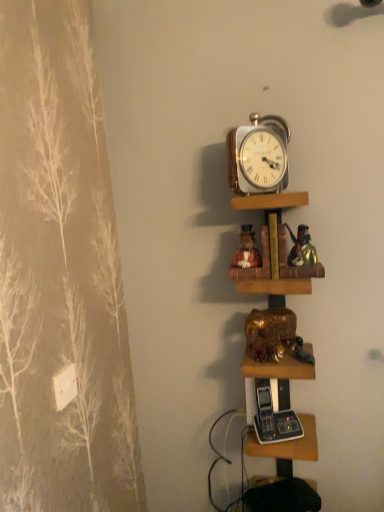
The width and height of the screenshot is (384, 512). What do you see at coordinates (274, 249) in the screenshot? I see `matte ceramic figurines at center, arranged as the first shelf when viewed from the top` at bounding box center [274, 249].

The width and height of the screenshot is (384, 512). Identify the location of gold metallic elephant at center. (270, 332).

Does gold metallic elephant at center contain matte ceramic figurines at center, arranged as the first shelf when viewed from the top?

No, gold metallic elephant at center does not contain matte ceramic figurines at center, arranged as the first shelf when viewed from the top.

From the image's perspective, is gold metallic elephant at center under matte ceramic figurines at center, the 2th shelf from the bottom?

Yes.

Identify the location of toy that appears below the matte ceramic figurines at center, arranged as the first shelf when viewed from the top (from the image's perspective). The height and width of the screenshot is (512, 384). (270, 332).

Is gold metallic elephant at center turned away from matte ceramic figurines at center, arranged as the first shelf when viewed from the top?

That's not correct — gold metallic elephant at center is not looking away from matte ceramic figurines at center, arranged as the first shelf when viewed from the top.

Considering the sizes of objects gold metallic alarm clock at upper center and matte ceramic figurines at center, arranged as the first shelf when viewed from the top, in the image provided, who is wider, gold metallic alarm clock at upper center or matte ceramic figurines at center, arranged as the first shelf when viewed from the top,?

matte ceramic figurines at center, arranged as the first shelf when viewed from the top, is wider.

Is matte ceramic figurines at center, the 2th shelf from the bottom, located within gold metallic alarm clock at upper center?

No, matte ceramic figurines at center, the 2th shelf from the bottom, is located outside of gold metallic alarm clock at upper center.

Looking at the image, does gold metallic alarm clock at upper center seem bigger or smaller compared to matte ceramic figurines at center, arranged as the first shelf when viewed from the top?

Clearly, gold metallic alarm clock at upper center is smaller in size than matte ceramic figurines at center, arranged as the first shelf when viewed from the top.

Can you confirm if gold metallic alarm clock at upper center is taller than matte ceramic figurines at center, the 2th shelf from the bottom?

Yes.

Is matte ceramic figurines at center, arranged as the first shelf when viewed from the top, bigger than wooden shelves at center, positioned as the second shelf in top-to-bottom order?

No, matte ceramic figurines at center, arranged as the first shelf when viewed from the top, is not bigger than wooden shelves at center, positioned as the second shelf in top-to-bottom order.

Is matte ceramic figurines at center, arranged as the first shelf when viewed from the top, placed right next to wooden shelves at center, positioned as the 1th shelf in bottom-to-top order?

Yes, the surface of matte ceramic figurines at center, arranged as the first shelf when viewed from the top, is in contact with wooden shelves at center, positioned as the 1th shelf in bottom-to-top order.

Does point (266, 204) come in front of point (313, 422)?

Yes, it is in front of point (313, 422).

From a real-world perspective, is matte ceramic figurines at center, the 2th shelf from the bottom, physically below wooden shelves at center, positioned as the second shelf in top-to-bottom order?

No, from a real-world perspective, matte ceramic figurines at center, the 2th shelf from the bottom, is not below wooden shelves at center, positioned as the second shelf in top-to-bottom order.

Is point (259, 285) closer or farther from the camera than point (276, 121)?

Clearly, point (259, 285) is closer to the camera than point (276, 121).

Which of these two, matte ceramic figurines at center, arranged as the first shelf when viewed from the top, or gold metallic alarm clock at upper center, is thinner?

gold metallic alarm clock at upper center.

Does matte ceramic figurines at center, the 2th shelf from the bottom, appear on the right side of gold metallic alarm clock at upper center?

Yes, matte ceramic figurines at center, the 2th shelf from the bottom, is to the right of gold metallic alarm clock at upper center.

From the picture: Is matte ceramic figurines at center, the 2th shelf from the bottom, facing away from gold metallic alarm clock at upper center?

matte ceramic figurines at center, the 2th shelf from the bottom, does not have its back to gold metallic alarm clock at upper center.

Is matte ceramic figurines at center, arranged as the first shelf when viewed from the top, in front of gold metallic elephant at center?

Yes, matte ceramic figurines at center, arranged as the first shelf when viewed from the top, is in front of gold metallic elephant at center.

Consider the image. Is matte ceramic figurines at center, the 2th shelf from the bottom, oriented towards gold metallic elephant at center?

No, matte ceramic figurines at center, the 2th shelf from the bottom, is not oriented towards gold metallic elephant at center.

You are a GUI agent. You are given a task and a screenshot of the screen. Output one action in this format:
    pyautogui.click(x=<x>, y=<y>)
    Task: Click on the shelf located on the left of gold metallic elephant at center
    The height and width of the screenshot is (512, 384).
    Given the screenshot: What is the action you would take?
    pyautogui.click(x=274, y=249)

Is matte ceramic figurines at center, arranged as the first shelf when viewed from the top, next to gold metallic elephant at center and touching it?

No, matte ceramic figurines at center, arranged as the first shelf when viewed from the top, is not next to gold metallic elephant at center.

From a real-world perspective, which object stands above the other?

From a 3D spatial view, gold metallic alarm clock at upper center is above.

Is gold metallic elephant at center facing towards gold metallic alarm clock at upper center?

No, gold metallic elephant at center is not oriented towards gold metallic alarm clock at upper center.

From the picture: How different are the orientations of gold metallic elephant at center and gold metallic alarm clock at upper center in degrees?

The facing directions of gold metallic elephant at center and gold metallic alarm clock at upper center are 40.7 degrees apart.

Which object is closer to the camera, gold metallic elephant at center or gold metallic alarm clock at upper center?

gold metallic alarm clock at upper center is more forward.

Based on the photo, would you consider gold metallic alarm clock at upper center to be distant from gold metallic elephant at center?

gold metallic alarm clock at upper center is near gold metallic elephant at center, not far away.

From a real-world perspective, is gold metallic alarm clock at upper center positioned under gold metallic elephant at center based on gravity?

No.

Considering the sizes of objects gold metallic alarm clock at upper center and gold metallic elephant at center in the image provided, who is shorter, gold metallic alarm clock at upper center or gold metallic elephant at center?

gold metallic elephant at center.

Identify the location of toy behind the matte ceramic figurines at center, arranged as the first shelf when viewed from the top. The height and width of the screenshot is (512, 384). (270, 332).

Find the location of a particular element. alarm clock on the left of the matte ceramic figurines at center, the 2th shelf from the bottom is located at coordinates (258, 155).

Considering their positions, is gold metallic elephant at center positioned further to wooden shelves at center, positioned as the 1th shelf in bottom-to-top order, than matte ceramic figurines at center, arranged as the first shelf when viewed from the top?

Based on the image, gold metallic elephant at center appears to be further to wooden shelves at center, positioned as the 1th shelf in bottom-to-top order.

Considering their positions, is wooden shelves at center, positioned as the second shelf in top-to-bottom order, positioned closer to gold metallic elephant at center than matte ceramic figurines at center, arranged as the first shelf when viewed from the top?

wooden shelves at center, positioned as the second shelf in top-to-bottom order, lies closer to gold metallic elephant at center than the other object.

From the image, which object appears to be farther from wooden shelves at center, positioned as the 1th shelf in bottom-to-top order, gold metallic alarm clock at upper center or gold metallic elephant at center?

Among the two, gold metallic alarm clock at upper center is located further to wooden shelves at center, positioned as the 1th shelf in bottom-to-top order.

Estimate the real-world distances between objects in this image. Which object is closer to wooden shelves at center, positioned as the second shelf in top-to-bottom order, gold metallic elephant at center or gold metallic alarm clock at upper center?

Based on the image, gold metallic elephant at center appears to be nearer to wooden shelves at center, positioned as the second shelf in top-to-bottom order.

When comparing their distances from gold metallic alarm clock at upper center, does gold metallic elephant at center or matte ceramic figurines at center, the 2th shelf from the bottom, seem further?

Based on the image, gold metallic elephant at center appears to be further to gold metallic alarm clock at upper center.

Based on their spatial positions, is gold metallic elephant at center or wooden shelves at center, positioned as the 1th shelf in bottom-to-top order, closer to gold metallic alarm clock at upper center?

wooden shelves at center, positioned as the 1th shelf in bottom-to-top order, is positioned closer to the anchor gold metallic alarm clock at upper center.

From the image, which object appears to be nearer to matte ceramic figurines at center, arranged as the first shelf when viewed from the top, wooden shelves at center, positioned as the 1th shelf in bottom-to-top order, or gold metallic alarm clock at upper center?

wooden shelves at center, positioned as the 1th shelf in bottom-to-top order, is positioned closer to the anchor matte ceramic figurines at center, arranged as the first shelf when viewed from the top.

Looking at the image, which one is located further to matte ceramic figurines at center, the 2th shelf from the bottom, wooden shelves at center, positioned as the 1th shelf in bottom-to-top order, or gold metallic elephant at center?

gold metallic elephant at center.

Find the location of a particular element. The height and width of the screenshot is (512, 384). shelf between gold metallic alarm clock at upper center and gold metallic elephant at center in the vertical direction is located at coordinates (274, 249).

I want to click on toy between matte ceramic figurines at center, arranged as the first shelf when viewed from the top, and wooden shelves at center, positioned as the 1th shelf in bottom-to-top order, in the up-down direction, so click(270, 332).

The height and width of the screenshot is (512, 384). I want to click on toy between gold metallic alarm clock at upper center and wooden shelves at center, positioned as the 1th shelf in bottom-to-top order, vertically, so click(x=270, y=332).

At what (x,y) coordinates should I click in order to perform the action: click on shelf between gold metallic alarm clock at upper center and wooden shelves at center, positioned as the second shelf in top-to-bottom order, from top to bottom. Please return your answer as a coordinate pair (x, y). This screenshot has height=512, width=384. Looking at the image, I should click on (274, 249).